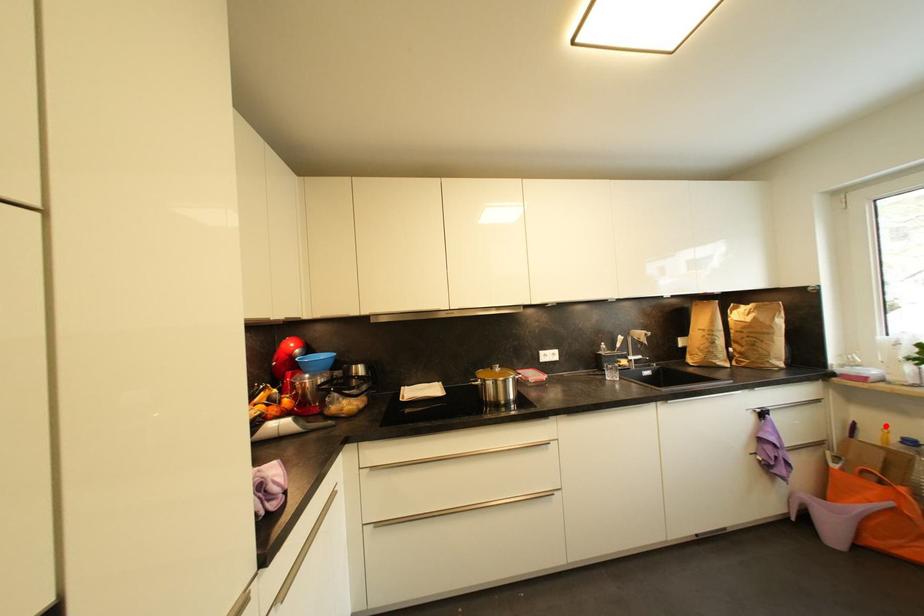
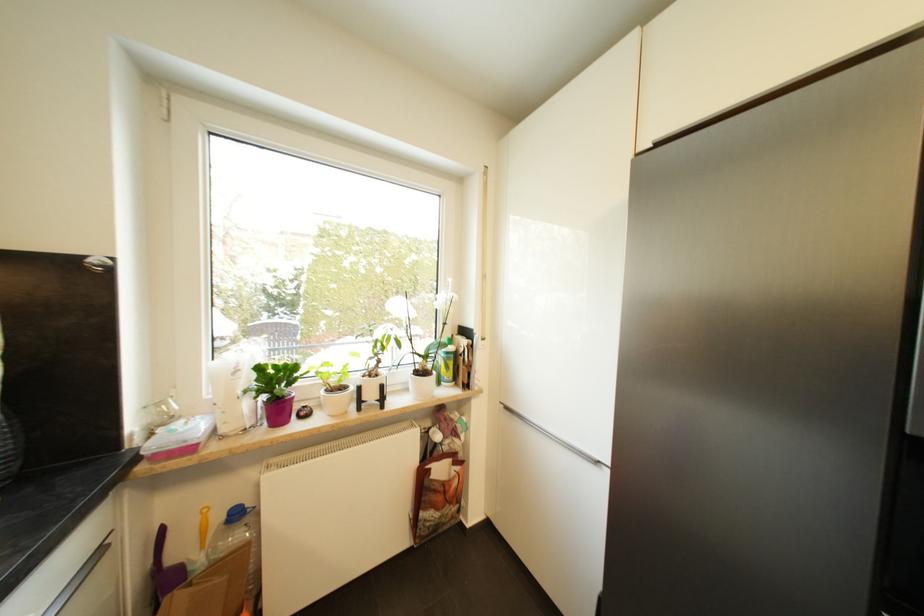
Where in the second image is the point corresponding to the highlighted location from the first image?

(207, 507)